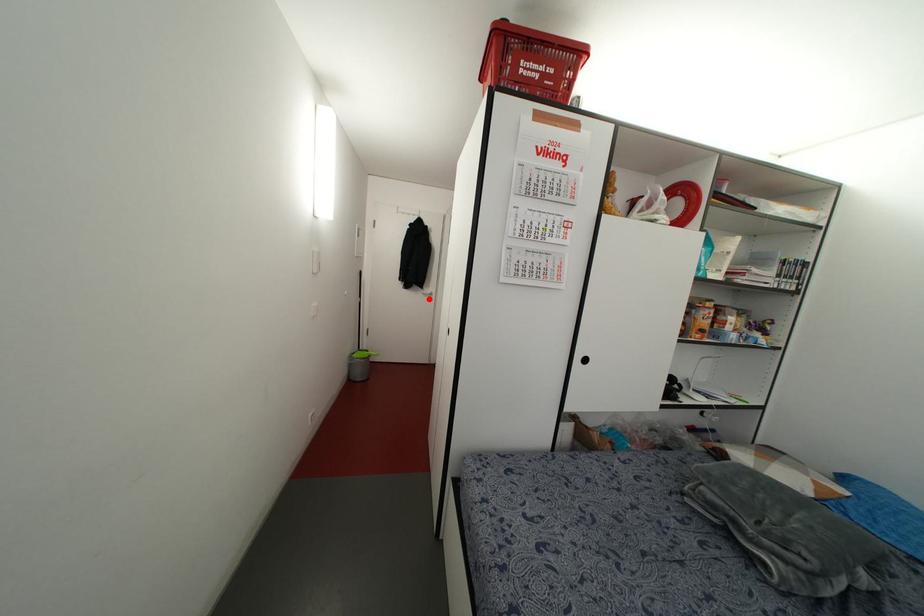
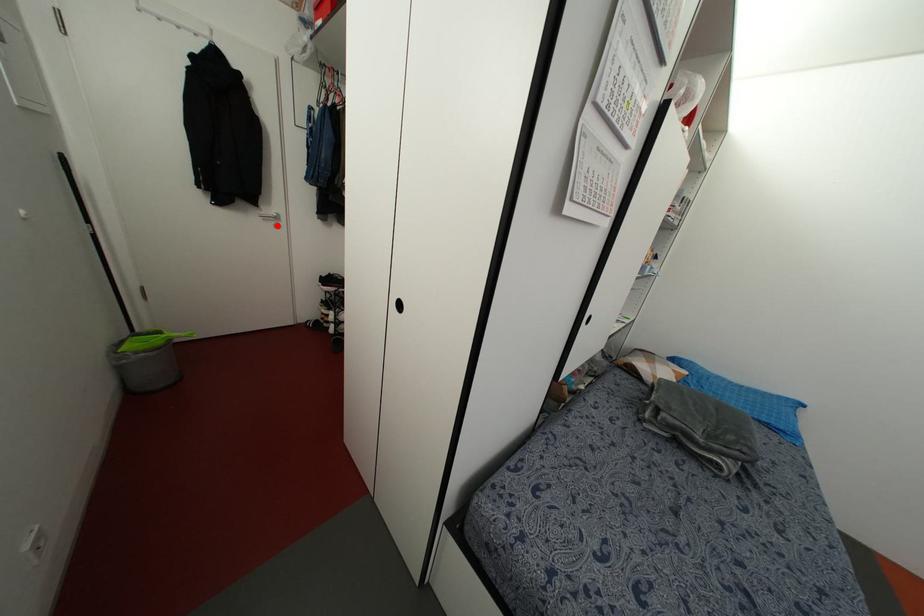
I am providing you with two images of the same scene from different viewpoints. A red point is marked on the first image and another point is marked on the second image. Does the point marked in image1 correspond to the same location as the one in image2?

Yes